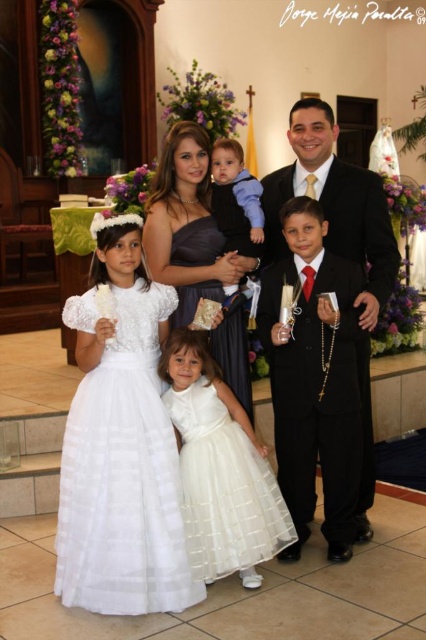
You are a photographer setting up for a family portrait in a church. You have two key outfits to consider for framing the shot. The black satin suit at right and the matte dark blue dress at center. Based on their sizes, which outfit requires more horizontal space in the frame?

The black satin suit at right requires more horizontal space in the frame because its width surpasses that of the matte dark blue dress at center.